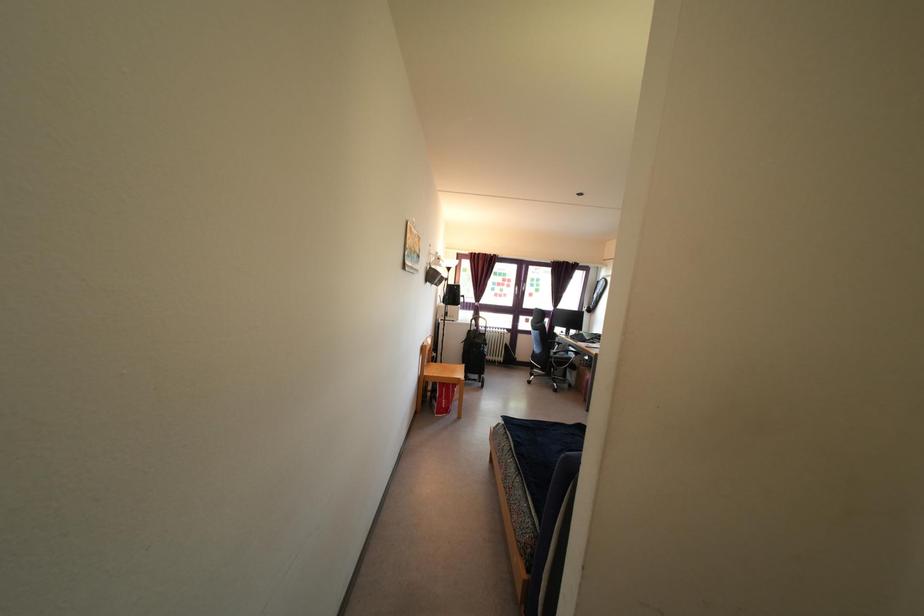
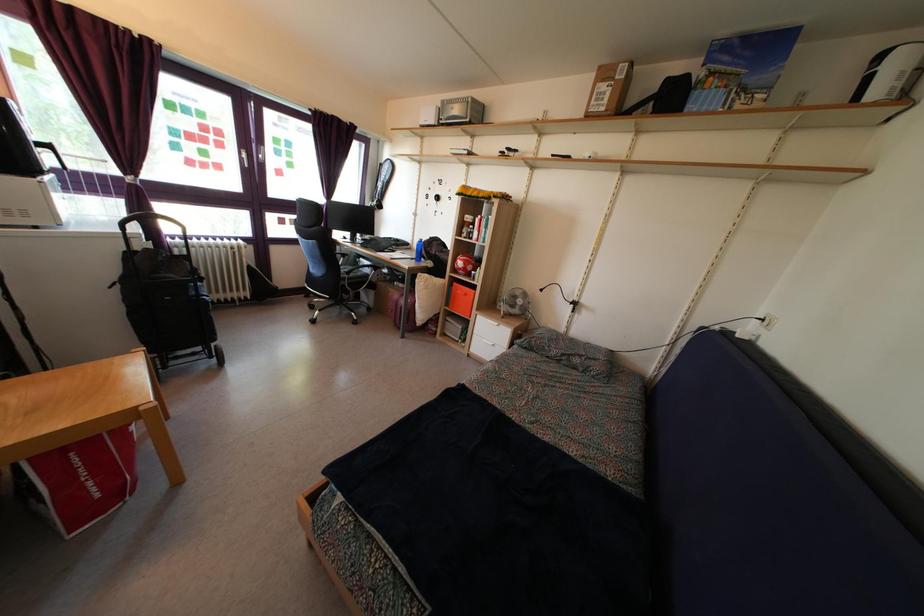
Find the pixel in the second image that matches pixel 479 326 in the first image.

(146, 225)